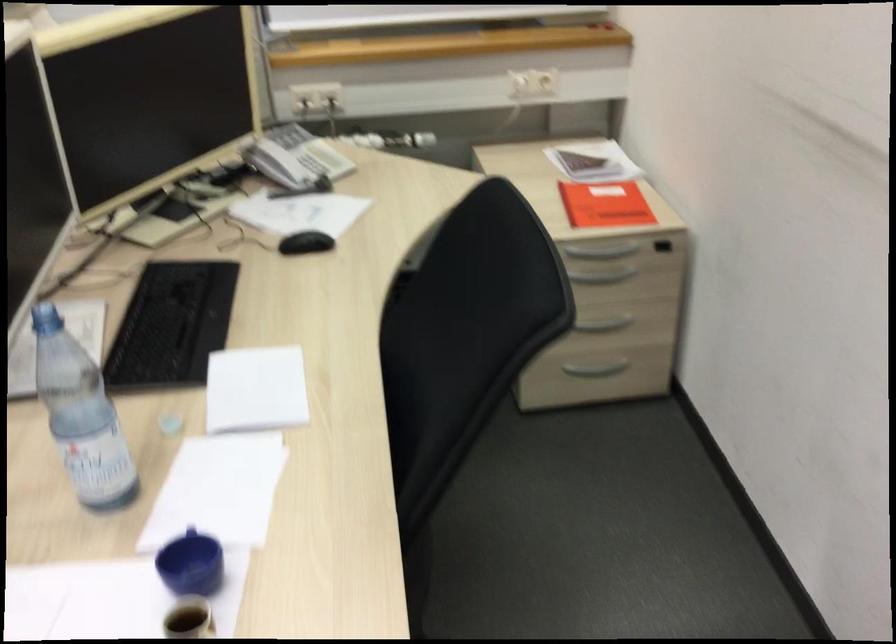
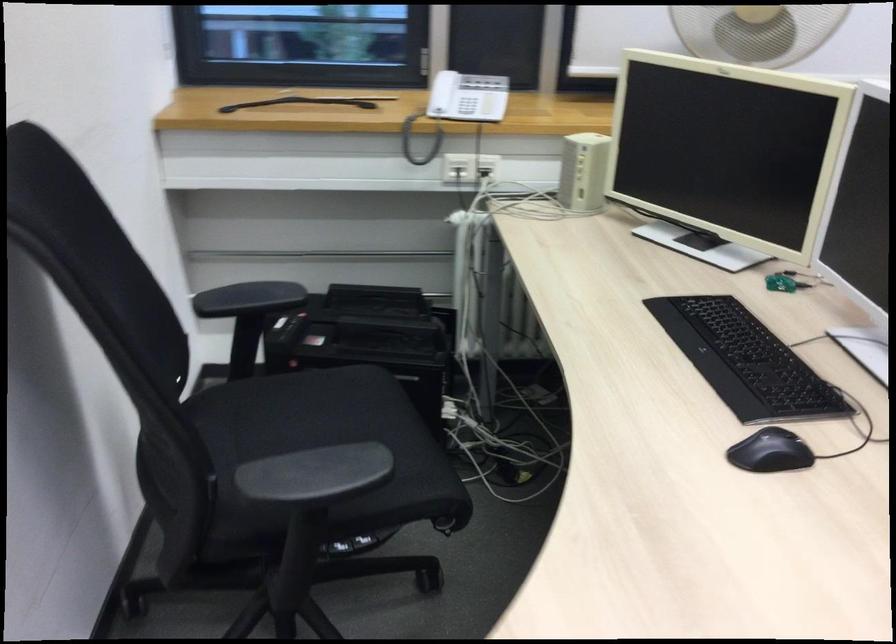
Question: The images are taken continuously from a first-person perspective. In which direction are you moving?

Choices:
 (A) Left
 (B) Right
 (C) Forward
 (D) Backward

Answer: (A)